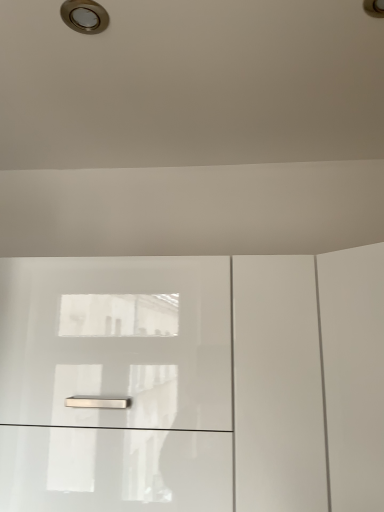
Question: Is glossy white cabinet at center positioned beyond the bounds of brushed metal droplight at upper left?

Choices:
 (A) yes
 (B) no

Answer: (A)

Question: Could brushed metal droplight at upper left be considered to be inside glossy white cabinet at center?

Choices:
 (A) yes
 (B) no

Answer: (B)

Question: Does glossy white cabinet at center have a lesser height compared to brushed metal droplight at upper left?

Choices:
 (A) no
 (B) yes

Answer: (A)

Question: Is glossy white cabinet at center positioned with its back to brushed metal droplight at upper left?

Choices:
 (A) yes
 (B) no

Answer: (B)

Question: Does glossy white cabinet at center have a greater height compared to brushed metal droplight at upper left?

Choices:
 (A) yes
 (B) no

Answer: (A)

Question: From the image's perspective, would you say glossy white cabinet at center is shown under brushed metal droplight at upper left?

Choices:
 (A) no
 (B) yes

Answer: (B)

Question: Can glossy white cabinet at center be found inside brushed metal droplight at upper left?

Choices:
 (A) yes
 (B) no

Answer: (B)

Question: Considering the relative sizes of brushed metal droplight at upper left and glossy white cabinet at center in the image provided, is brushed metal droplight at upper left wider than glossy white cabinet at center?

Choices:
 (A) yes
 (B) no

Answer: (B)

Question: From the image's perspective, is brushed metal droplight at upper left beneath glossy white cabinet at center?

Choices:
 (A) yes
 (B) no

Answer: (B)

Question: Is brushed metal droplight at upper left aimed at glossy white cabinet at center?

Choices:
 (A) no
 (B) yes

Answer: (A)

Question: Can you confirm if brushed metal droplight at upper left is taller than glossy white cabinet at center?

Choices:
 (A) no
 (B) yes

Answer: (A)

Question: From a real-world perspective, is brushed metal droplight at upper left located beneath glossy white cabinet at center?

Choices:
 (A) no
 (B) yes

Answer: (A)

Question: Based on their positions, is glossy white cabinet at center located to the left or right of brushed metal droplight at upper left?

Choices:
 (A) right
 (B) left

Answer: (A)